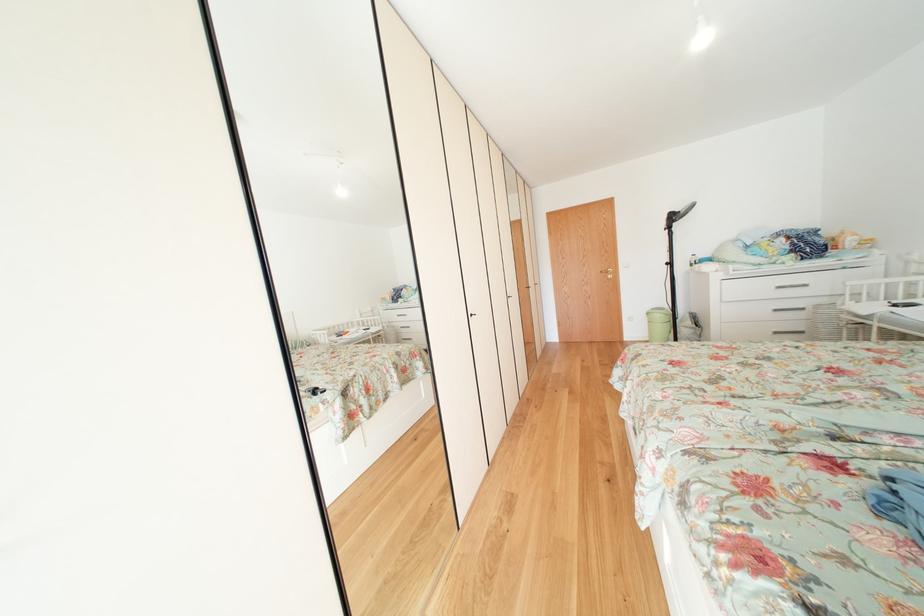
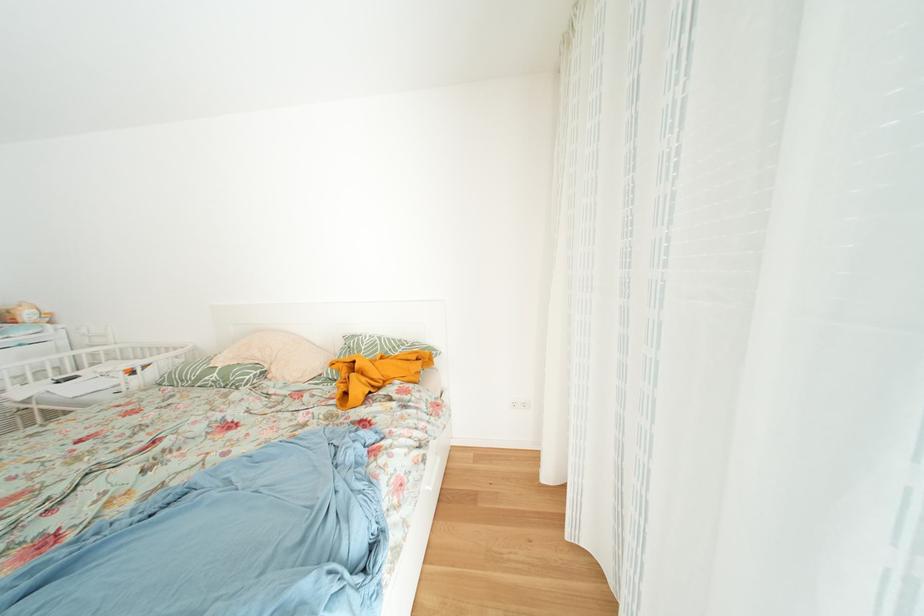
Question: Based on the continuous images, in which direction is the camera rotating? Reply with the corresponding letter.

Choices:
 (A) Left
 (B) Right
 (C) Up
 (D) Down

Answer: (B)